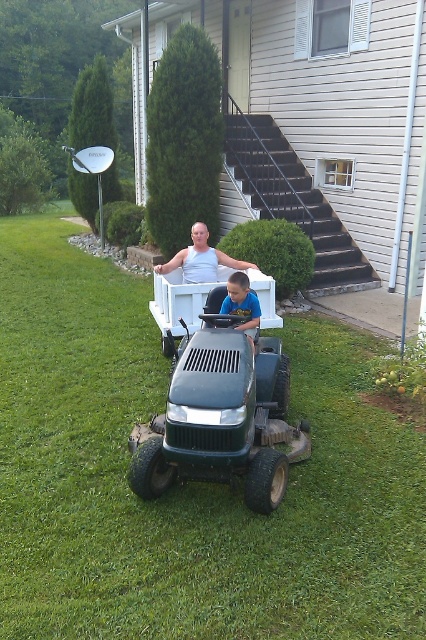
Which is in front, point (331, 372) or point (215, 273)?

Point (331, 372)

Between green grass at center and white tank top at center, which one has more height?

green grass at center

What do you see at coordinates (189, 483) in the screenshot?
I see `green grass at center` at bounding box center [189, 483].

You are a GUI agent. You are given a task and a screenshot of the screen. Output one action in this format:
    pyautogui.click(x=<x>, y=<y>)
    Task: Click on the green grass at center
    
    Given the screenshot: What is the action you would take?
    pyautogui.click(x=189, y=483)

Can you confirm if green grass at center is positioned to the right of white plastic wagon at center?

Yes, green grass at center is to the right of white plastic wagon at center.

Between green grass at center and white plastic wagon at center, which one appears on the right side from the viewer's perspective?

green grass at center

Based on the photo, who is more forward, (109, 577) or (158, 300)?

Positioned in front is point (109, 577).

Where is `green grass at center`? green grass at center is located at coordinates pyautogui.click(x=189, y=483).

Can you confirm if white plastic wagon at center is thinner than white tank top at center?

Yes.

Based on the photo, measure the distance between white plastic wagon at center and camera.

white plastic wagon at center and camera are 5.79 meters apart from each other.

Measure the distance between white plastic wagon at center and camera.

They are 18.98 feet apart.

This screenshot has width=426, height=640. I want to click on white plastic wagon at center, so click(x=181, y=301).